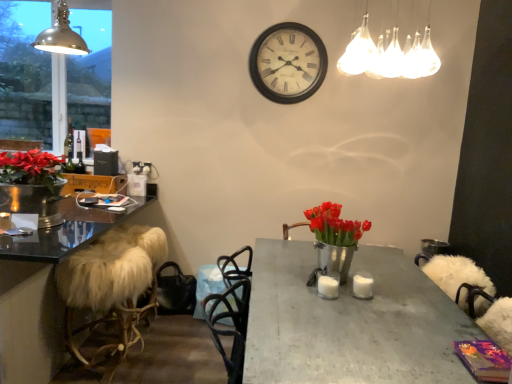
You are a GUI agent. You are given a task and a screenshot of the screen. Output one action in this format:
    pyautogui.click(x=<x>, y=<y>)
    Task: Click on the free space between white matte candle at center, which appears as the 1th candle when viewed from the left, and white matte candle at table center, which appears as the second candle when viewed from the left
    
    Given the screenshot: What is the action you would take?
    pyautogui.click(x=349, y=289)